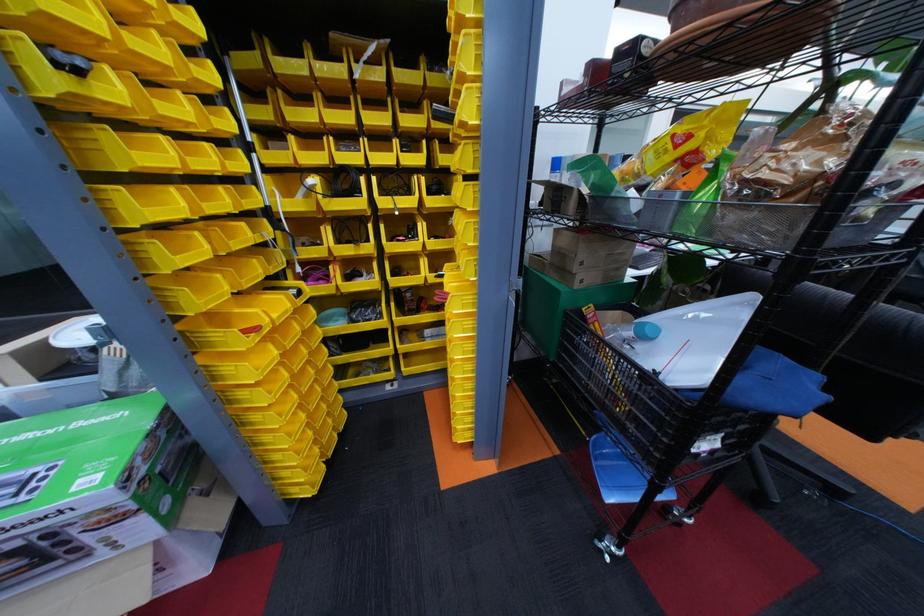
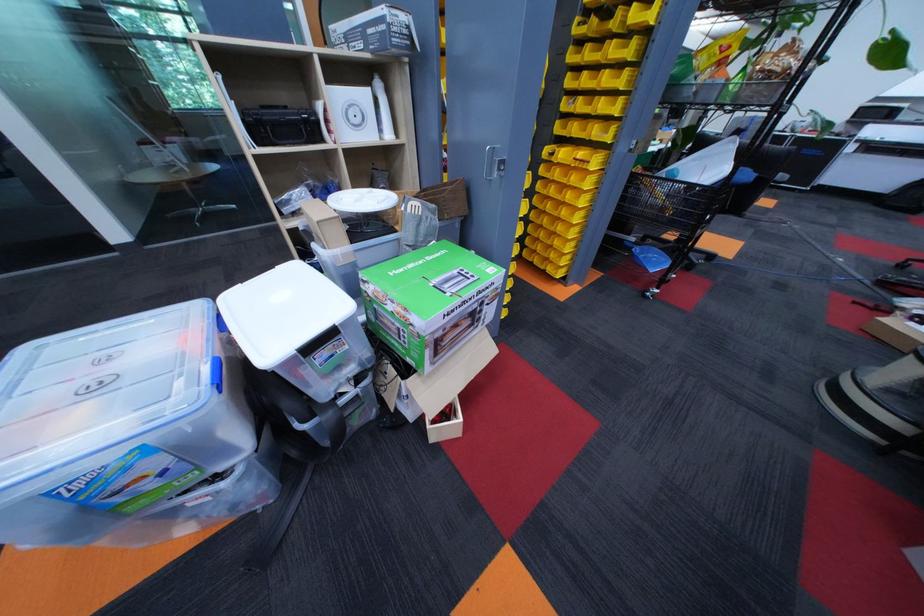
Question: The images are taken continuously from a first-person perspective. In which direction are you moving?

Choices:
 (A) Left
 (B) Right
 (C) Forward
 (D) Backward

Answer: (A)